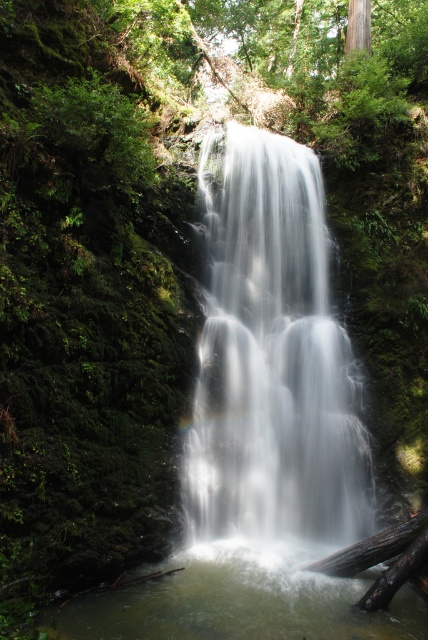
Question: Which object appears farthest from the camera in this image?

Choices:
 (A) white silky waterfall at center
 (B) clear water at center

Answer: (A)

Question: Among these points, which one is nearest to the camera?

Choices:
 (A) (314, 483)
 (B) (237, 582)

Answer: (B)

Question: Can you confirm if white silky waterfall at center is smaller than clear water at center?

Choices:
 (A) no
 (B) yes

Answer: (A)

Question: Is white silky waterfall at center to the left of clear water at center from the viewer's perspective?

Choices:
 (A) yes
 (B) no

Answer: (B)

Question: Can you confirm if white silky waterfall at center is positioned to the left of clear water at center?

Choices:
 (A) no
 (B) yes

Answer: (A)